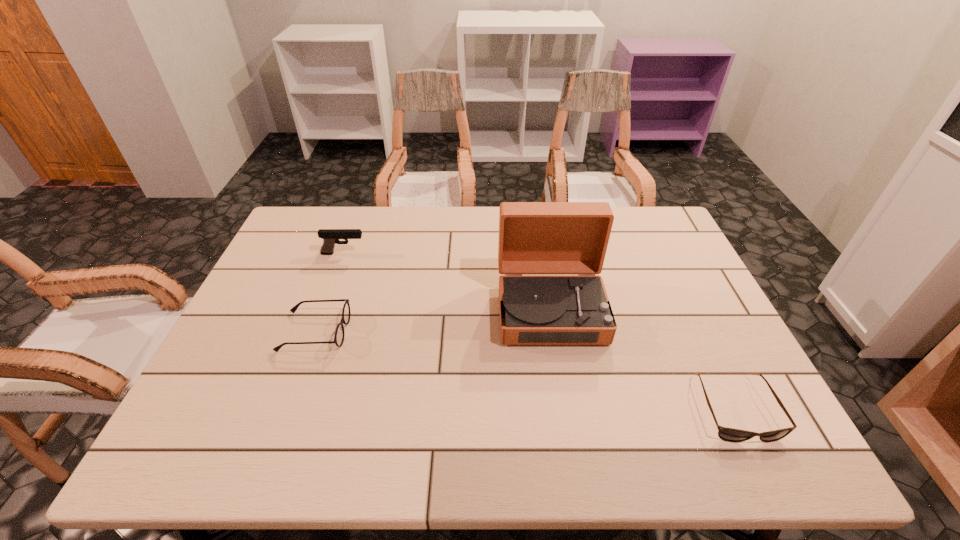
Where is `object present at the near edge`? object present at the near edge is located at coordinates 726,434.

Find the location of a particular element. The width and height of the screenshot is (960, 540). pistol that is positioned at the left edge is located at coordinates (330, 237).

This screenshot has width=960, height=540. In order to click on spectacles that is at the left edge in this screenshot , I will do [x=339, y=333].

Identify the location of object that is at the right edge. (726, 434).

The width and height of the screenshot is (960, 540). I want to click on object present at the near right corner, so click(726, 434).

Where is `vacant space at the far edge`? vacant space at the far edge is located at coordinates (414, 219).

Where is `vacant space at the near edge of the desktop`? Image resolution: width=960 pixels, height=540 pixels. vacant space at the near edge of the desktop is located at coordinates (685, 434).

The image size is (960, 540). What are the coordinates of `blank space at the left edge` in the screenshot? It's located at (261, 353).

Image resolution: width=960 pixels, height=540 pixels. In the image, there is a desktop. Identify the location of vacant space at the far left corner. (313, 238).

Identify the location of vacant space at the far right corner of the desktop. (638, 244).